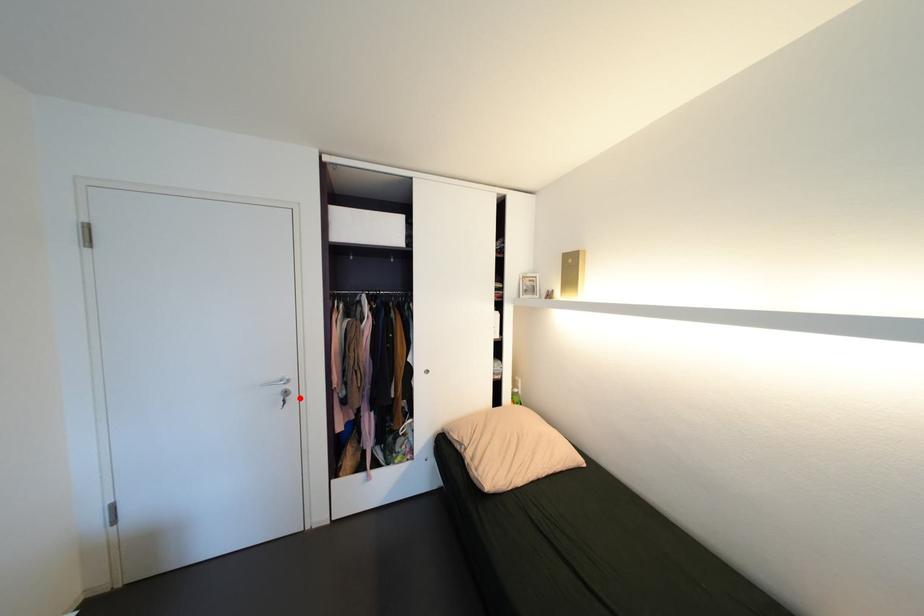
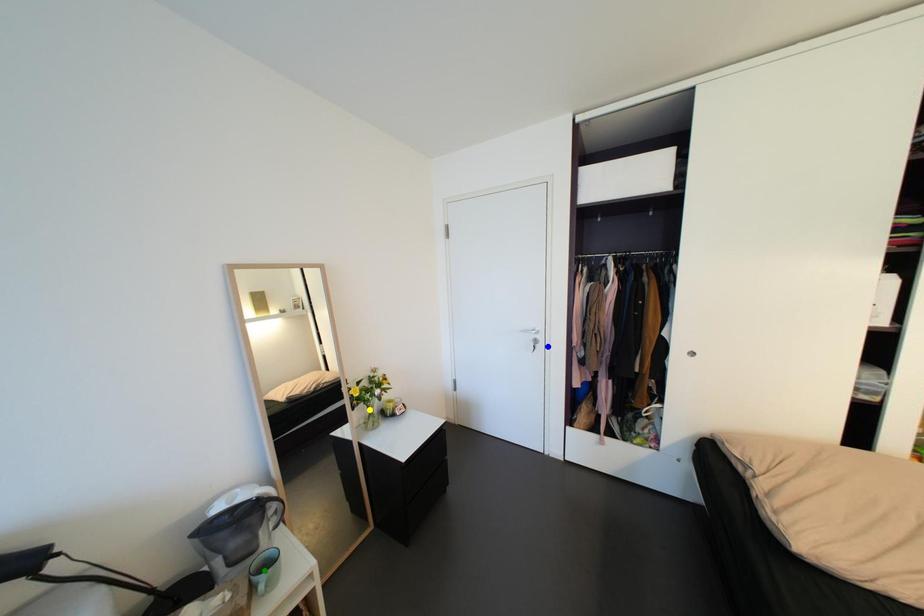
Question: I am providing you with two images of the same scene from different viewpoints. A red point is marked on the first image. You are given multiple points on the second image. Which point in image 2 represents the same 3d spot as the red point in image 1?

Choices:
 (A) blue point
 (B) green point
 (C) yellow point

Answer: (A)